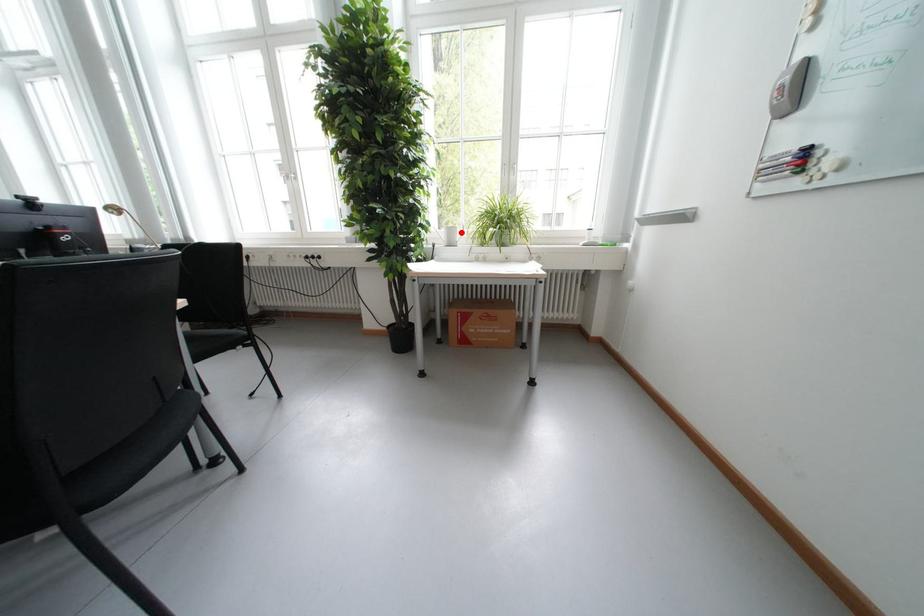
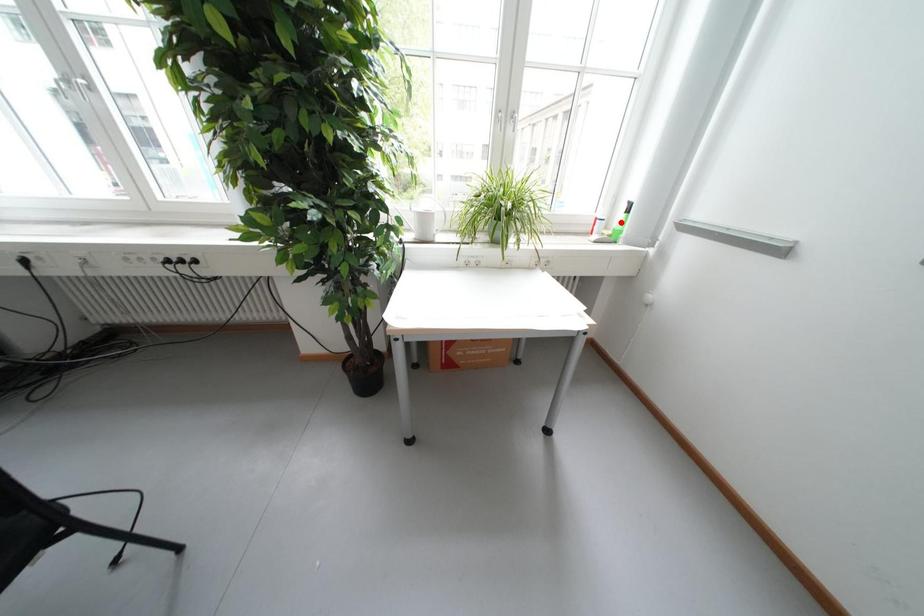
I am providing you with two images of the same scene from different viewpoints. A red point is marked on the first image and another point is marked on the second image. Are the points marked in image1 and image2 representing the same 3D position?

No